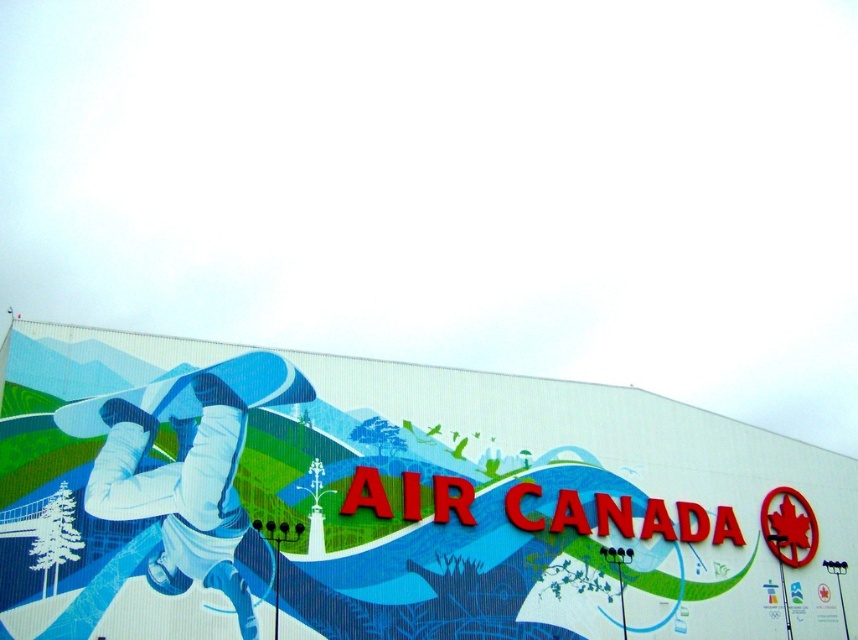
Question: Does matte blue snowboarder at center have a larger size compared to blue glossy skateboard at center-left?

Choices:
 (A) yes
 (B) no

Answer: (A)

Question: Among these objects, which one is farthest from the camera?

Choices:
 (A) matte blue snowboarder at center
 (B) blue glossy skateboard at center-left

Answer: (B)

Question: Is matte blue snowboarder at center positioned in front of blue glossy skateboard at center-left?

Choices:
 (A) yes
 (B) no

Answer: (A)

Question: Does matte blue snowboarder at center appear on the left side of blue glossy skateboard at center-left?

Choices:
 (A) yes
 (B) no

Answer: (B)